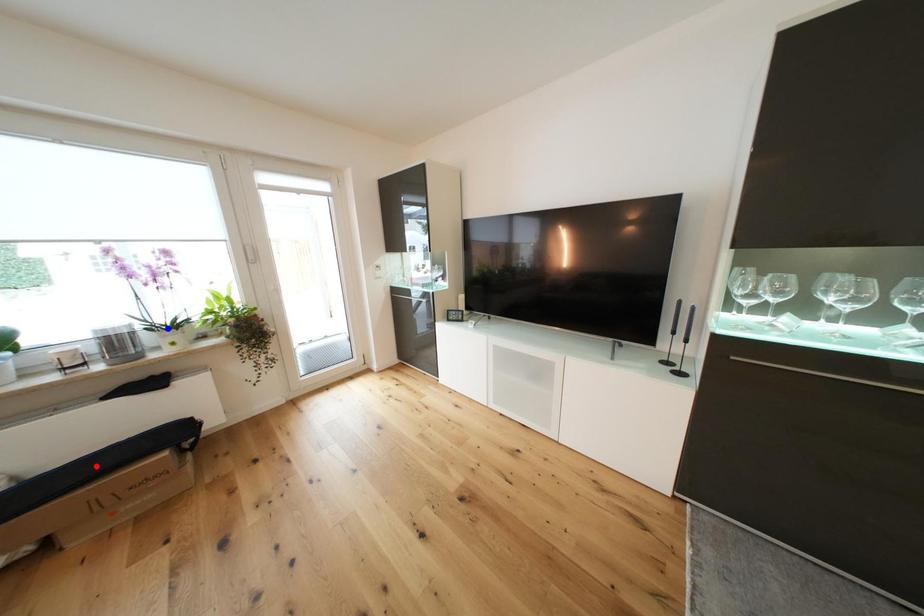
Question: In the image, two points are highlighted. Which point is nearer to the camera? Reply with the corresponding letter.

Choices:
 (A) blue point
 (B) red point

Answer: (B)